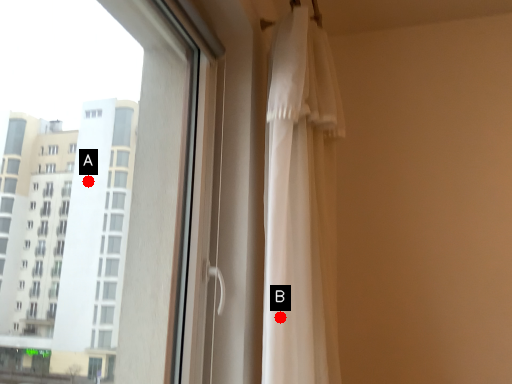
Question: Two points are circled on the image, labeled by A and B beside each circle. Which point is farther to the camera?

Choices:
 (A) A is further
 (B) B is further

Answer: (A)